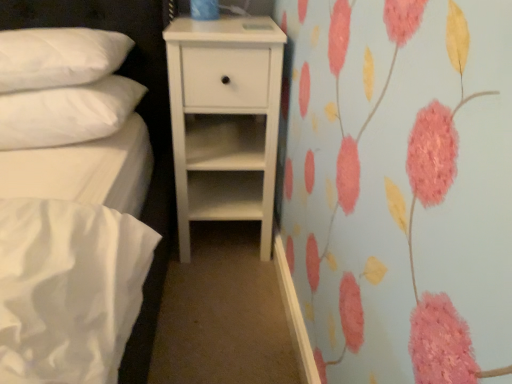
What do you see at coordinates (224, 121) in the screenshot? The height and width of the screenshot is (384, 512). I see `white matte chest of drawers at center` at bounding box center [224, 121].

Locate an element on the screen. This screenshot has width=512, height=384. white soft pillow at upper left, arranged as the second pillow when viewed from the top is located at coordinates (67, 113).

Is the surface of white quilted pillow at upper left, the 2th pillow positioned from the bottom, in direct contact with white matte chest of drawers at center?

No, white quilted pillow at upper left, the 2th pillow positioned from the bottom, is not touching white matte chest of drawers at center.

Is white quilted pillow at upper left, the 2th pillow positioned from the bottom, positioned beyond the bounds of white matte chest of drawers at center?

Indeed, white quilted pillow at upper left, the 2th pillow positioned from the bottom, is completely outside white matte chest of drawers at center.

Could you tell me if white quilted pillow at upper left, the 2th pillow positioned from the bottom, is facing white matte chest of drawers at center?

No, white quilted pillow at upper left, the 2th pillow positioned from the bottom, is not facing towards white matte chest of drawers at center.

From a real-world perspective, which is physically above, white quilted pillow at upper left, the 2th pillow positioned from the bottom, or white matte chest of drawers at center?

From a 3D spatial view, white quilted pillow at upper left, the 2th pillow positioned from the bottom, is above.

From the image's perspective, which is below, white soft pillow at upper left, marked as the 1th pillow in a bottom-to-top arrangement, or white matte chest of drawers at center?

white matte chest of drawers at center appears lower in the image.

Is white soft pillow at upper left, arranged as the second pillow when viewed from the top, completely or partially outside of white matte chest of drawers at center?

Absolutely, white soft pillow at upper left, arranged as the second pillow when viewed from the top, is external to white matte chest of drawers at center.

Is white soft pillow at upper left, arranged as the second pillow when viewed from the top, aimed at white matte chest of drawers at center?

No, white soft pillow at upper left, arranged as the second pillow when viewed from the top, is not aimed at white matte chest of drawers at center.

Is white quilted pillow at upper left, the 2th pillow positioned from the bottom, thinner than white soft pillow at upper left, marked as the 1th pillow in a bottom-to-top arrangement?

Yes, white quilted pillow at upper left, the 2th pillow positioned from the bottom, is thinner than white soft pillow at upper left, marked as the 1th pillow in a bottom-to-top arrangement.

How much distance is there between white quilted pillow at upper left, which is the first pillow from top to bottom, and white soft pillow at upper left, marked as the 1th pillow in a bottom-to-top arrangement?

white quilted pillow at upper left, which is the first pillow from top to bottom, and white soft pillow at upper left, marked as the 1th pillow in a bottom-to-top arrangement, are 3.89 inches apart.

From a real-world perspective, is white quilted pillow at upper left, which is the first pillow from top to bottom, positioned above or below white soft pillow at upper left, arranged as the second pillow when viewed from the top?

Clearly, from a real-world perspective, white quilted pillow at upper left, which is the first pillow from top to bottom, is above white soft pillow at upper left, arranged as the second pillow when viewed from the top.

How many degrees apart are the facing directions of white quilted pillow at upper left, the 2th pillow positioned from the bottom, and white soft pillow at upper left, marked as the 1th pillow in a bottom-to-top arrangement?

The angular difference between white quilted pillow at upper left, the 2th pillow positioned from the bottom, and white soft pillow at upper left, marked as the 1th pillow in a bottom-to-top arrangement, is 0.494 degrees.

Considering the relative positions of white soft pillow at upper left, marked as the 1th pillow in a bottom-to-top arrangement, and white quilted pillow at upper left, which is the first pillow from top to bottom, in the image provided, is white soft pillow at upper left, marked as the 1th pillow in a bottom-to-top arrangement, to the left of white quilted pillow at upper left, which is the first pillow from top to bottom, from the viewer's perspective?

A: Incorrect, white soft pillow at upper left, marked as the 1th pillow in a bottom-to-top arrangement, is not on the left side of white quilted pillow at upper left, which is the first pillow from top to bottom.

Looking at their sizes, would you say white soft pillow at upper left, arranged as the second pillow when viewed from the top, is wider or thinner than white quilted pillow at upper left, which is the first pillow from top to bottom?

Considering their sizes, white soft pillow at upper left, arranged as the second pillow when viewed from the top, looks broader than white quilted pillow at upper left, which is the first pillow from top to bottom.

Is white soft pillow at upper left, arranged as the second pillow when viewed from the top, beside white quilted pillow at upper left, which is the first pillow from top to bottom?

Yes, white soft pillow at upper left, arranged as the second pillow when viewed from the top, is in contact with white quilted pillow at upper left, which is the first pillow from top to bottom.

From the picture: Could you tell me if white soft pillow at upper left, marked as the 1th pillow in a bottom-to-top arrangement, is turned towards white quilted pillow at upper left, the 2th pillow positioned from the bottom?

No.

From the image's perspective, is white matte chest of drawers at center over white quilted pillow at upper left, which is the first pillow from top to bottom?

No, from the image's perspective, white matte chest of drawers at center is not over white quilted pillow at upper left, which is the first pillow from top to bottom.

Locate an element on the screen. This screenshot has width=512, height=384. the chest of drawers below the white quilted pillow at upper left, which is the first pillow from top to bottom (from the image's perspective) is located at coordinates (224, 121).

Which object is positioned more to the right, white matte chest of drawers at center or white quilted pillow at upper left, the 2th pillow positioned from the bottom?

From the viewer's perspective, white matte chest of drawers at center appears more on the right side.

Is point (170, 107) in front of point (56, 28)?

No.

Is white matte chest of drawers at center next to white soft pillow at upper left, marked as the 1th pillow in a bottom-to-top arrangement, and touching it?

No, white matte chest of drawers at center is not next to white soft pillow at upper left, marked as the 1th pillow in a bottom-to-top arrangement.

Is white matte chest of drawers at center bigger or smaller than white soft pillow at upper left, marked as the 1th pillow in a bottom-to-top arrangement?

In the image, white matte chest of drawers at center appears to be larger than white soft pillow at upper left, marked as the 1th pillow in a bottom-to-top arrangement.

From a real-world perspective, between white matte chest of drawers at center and white soft pillow at upper left, arranged as the second pillow when viewed from the top, who is vertically higher?

white soft pillow at upper left, arranged as the second pillow when viewed from the top, is physically above.

Does point (212, 190) come farther from viewer compared to point (42, 109)?

Yes, it is behind point (42, 109).

Starting from the white matte chest of drawers at center, which pillow is the 2nd one in front? Please provide its 2D coordinates.

[(58, 57)]

What are the coordinates of `chest of drawers on the right of the white soft pillow at upper left, marked as the 1th pillow in a bottom-to-top arrangement` in the screenshot? It's located at (224, 121).

Which object lies nearer to the anchor point white matte chest of drawers at center, white soft pillow at upper left, arranged as the second pillow when viewed from the top, or white quilted pillow at upper left, which is the first pillow from top to bottom?

white soft pillow at upper left, arranged as the second pillow when viewed from the top.

Which object lies nearer to the anchor point white soft pillow at upper left, arranged as the second pillow when viewed from the top, white matte chest of drawers at center or white quilted pillow at upper left, which is the first pillow from top to bottom?

white quilted pillow at upper left, which is the first pillow from top to bottom, is positioned closer to the anchor white soft pillow at upper left, arranged as the second pillow when viewed from the top.

Based on their spatial positions, is white soft pillow at upper left, marked as the 1th pillow in a bottom-to-top arrangement, or white matte chest of drawers at center further from white quilted pillow at upper left, the 2th pillow positioned from the bottom?

white matte chest of drawers at center.

Based on their spatial positions, is white matte chest of drawers at center or white soft pillow at upper left, marked as the 1th pillow in a bottom-to-top arrangement, closer to white quilted pillow at upper left, which is the first pillow from top to bottom?

The object closer to white quilted pillow at upper left, which is the first pillow from top to bottom, is white soft pillow at upper left, marked as the 1th pillow in a bottom-to-top arrangement.

From the image, which object appears to be farther from white soft pillow at upper left, marked as the 1th pillow in a bottom-to-top arrangement, white quilted pillow at upper left, which is the first pillow from top to bottom, or white matte chest of drawers at center?

white matte chest of drawers at center.

Based on their spatial positions, is white quilted pillow at upper left, the 2th pillow positioned from the bottom, or white soft pillow at upper left, marked as the 1th pillow in a bottom-to-top arrangement, further from white matte chest of drawers at center?

white quilted pillow at upper left, the 2th pillow positioned from the bottom, lies further to white matte chest of drawers at center than the other object.

Identify the location of pillow between white quilted pillow at upper left, the 2th pillow positioned from the bottom, and white matte chest of drawers at center, in the horizontal direction. (67, 113).